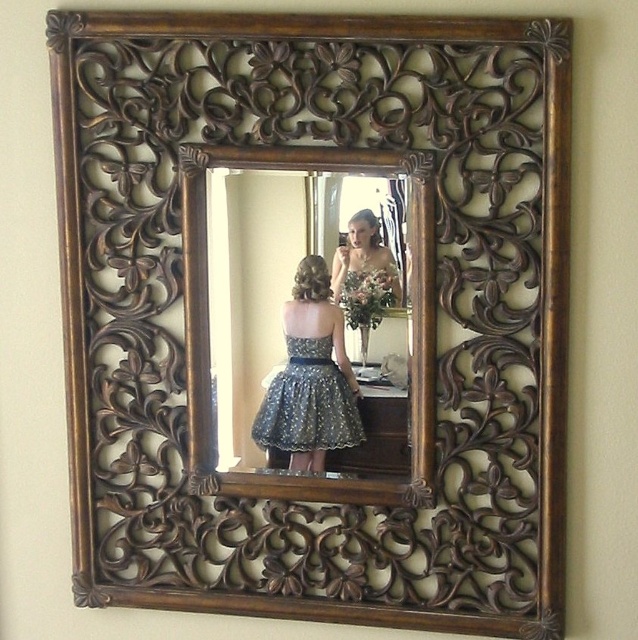
Does point (297, 154) come in front of point (350, 225)?

Yes.

Is wooden carved mirror at center positioned at the back of matte silver dress at center?

No, wooden carved mirror at center is closer to the viewer.

Locate an element on the screen. wooden carved mirror at center is located at coordinates (209, 330).

Between sparkly dark blue dress at center and matte silver dress at center, which one appears on the right side from the viewer's perspective?

From the viewer's perspective, matte silver dress at center appears more on the right side.

Which of these two, sparkly dark blue dress at center or matte silver dress at center, stands taller?

Standing taller between the two is sparkly dark blue dress at center.

Locate an element on the screen. The height and width of the screenshot is (640, 638). sparkly dark blue dress at center is located at coordinates (308, 403).

Is sparkly dark blue dress at center positioned before green matte bouquet at center?

That is False.

Is point (302, 385) closer to viewer compared to point (389, 275)?

No.

This screenshot has height=640, width=638. I want to click on sparkly dark blue dress at center, so click(x=308, y=403).